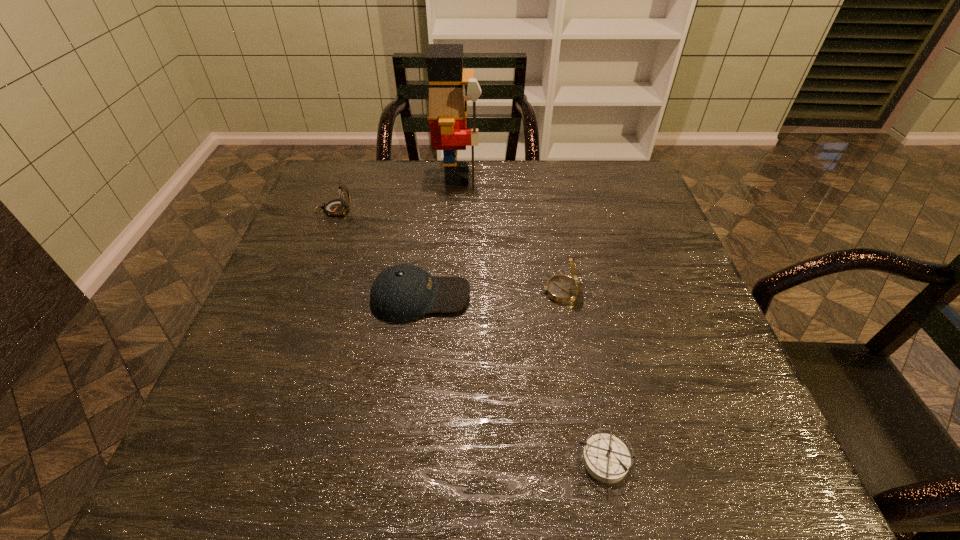
Locate an element on the screen. The height and width of the screenshot is (540, 960). free spot at the far edge of the desktop is located at coordinates (572, 162).

You are a GUI agent. You are given a task and a screenshot of the screen. Output one action in this format:
    pyautogui.click(x=<x>, y=<y>)
    Task: Click on the vacant space at the left edge
    The height and width of the screenshot is (540, 960).
    Given the screenshot: What is the action you would take?
    pyautogui.click(x=282, y=412)

You are a GUI agent. You are given a task and a screenshot of the screen. Output one action in this format:
    pyautogui.click(x=<x>, y=<y>)
    Task: Click on the free space at the right edge of the desktop
    The image size is (960, 540).
    Given the screenshot: What is the action you would take?
    pyautogui.click(x=719, y=373)

At what (x,y) coordinates should I click in order to perform the action: click on free space at the near left corner of the desktop. Please return your answer as a coordinate pair (x, y). Looking at the image, I should click on (188, 488).

I want to click on vacant space at the far right corner of the desktop, so click(631, 172).

You are a GUI agent. You are given a task and a screenshot of the screen. Output one action in this format:
    pyautogui.click(x=<x>, y=<y>)
    Task: Click on the free space between the shortest object and the second shortest object
    
    Given the screenshot: What is the action you would take?
    pyautogui.click(x=513, y=379)

Where is `vacant area that lies between the second nearest compass and the tallest object`? The width and height of the screenshot is (960, 540). vacant area that lies between the second nearest compass and the tallest object is located at coordinates click(509, 234).

You are a GUI agent. You are given a task and a screenshot of the screen. Output one action in this format:
    pyautogui.click(x=<x>, y=<y>)
    Task: Click on the free space between the second shortest object and the farthest object
    The height and width of the screenshot is (540, 960).
    Given the screenshot: What is the action you would take?
    pyautogui.click(x=439, y=237)

Where is `vacant point located between the second farthest compass and the nutcracker`? The height and width of the screenshot is (540, 960). vacant point located between the second farthest compass and the nutcracker is located at coordinates (509, 234).

Locate an element on the screen. The height and width of the screenshot is (540, 960). empty space that is in between the second shortest object and the nearest object is located at coordinates (513, 379).